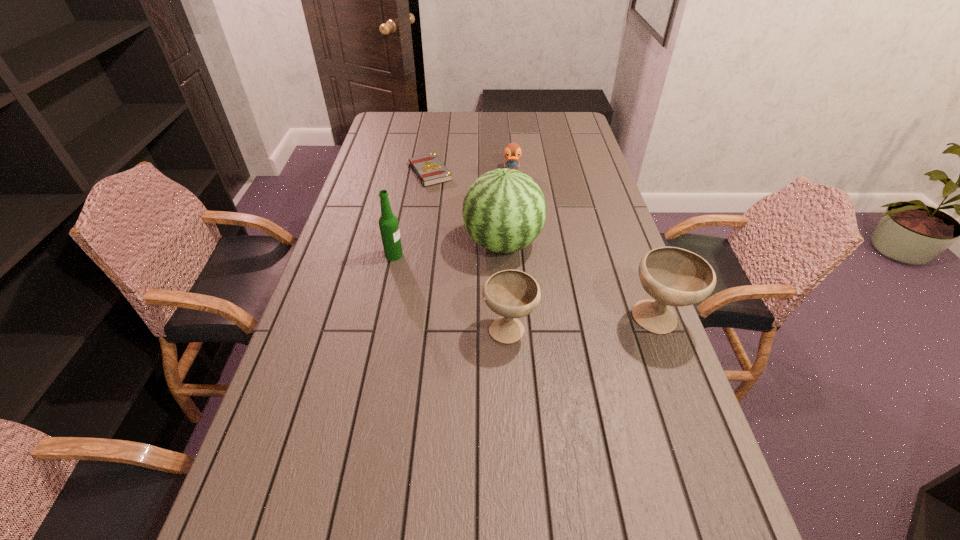
This screenshot has height=540, width=960. In order to click on free space located on the front of the shortest object in this screenshot , I will do `click(418, 256)`.

Locate an element on the screen. The width and height of the screenshot is (960, 540). vacant space situated on the front-facing side of the duck is located at coordinates (516, 212).

Image resolution: width=960 pixels, height=540 pixels. Find the location of `vacant space situated on the label of the fifth shortest object`. vacant space situated on the label of the fifth shortest object is located at coordinates (494, 255).

Where is `vacant space located 0.230m on the front of the tallest object`? vacant space located 0.230m on the front of the tallest object is located at coordinates (508, 331).

You are a GUI agent. You are given a task and a screenshot of the screen. Output one action in this format:
    pyautogui.click(x=<x>, y=<y>)
    Task: Click on the object that is at the right edge
    Image resolution: width=960 pixels, height=540 pixels.
    Given the screenshot: What is the action you would take?
    pyautogui.click(x=673, y=276)

Locate an element on the screen. The height and width of the screenshot is (540, 960). vacant area at the far edge is located at coordinates (487, 129).

Where is `vacant space at the left edge of the desktop`? This screenshot has width=960, height=540. vacant space at the left edge of the desktop is located at coordinates (377, 266).

I want to click on free region at the right edge of the desktop, so click(566, 180).

The image size is (960, 540). What are the coordinates of `free space at the far left corner` in the screenshot? It's located at (416, 116).

Find the location of a particular element. vacant area that lies between the beer bottle and the left chalice is located at coordinates tap(451, 292).